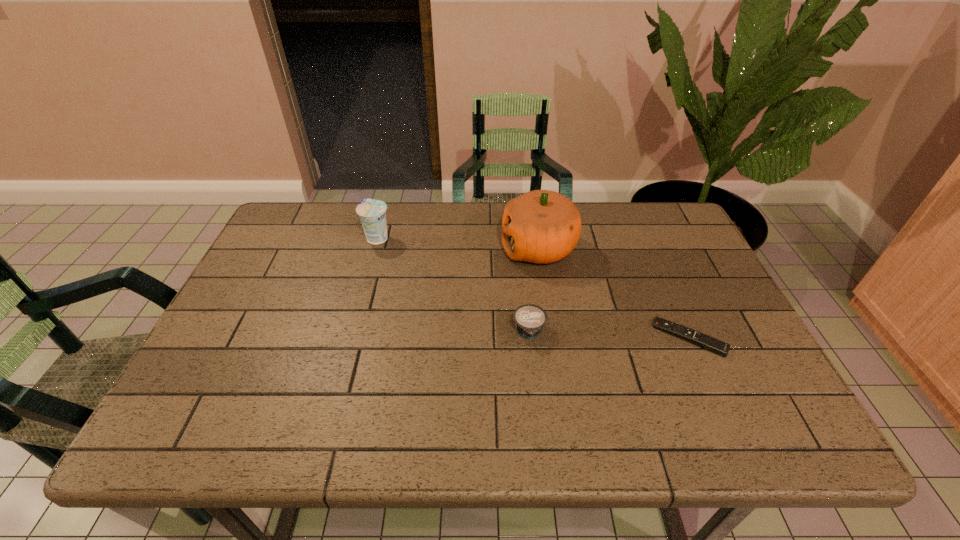
Find the location of a particular element. pumpkin is located at coordinates (541, 226).

Image resolution: width=960 pixels, height=540 pixels. Find the location of `the farther yogurt`. the farther yogurt is located at coordinates (372, 213).

Where is `the taller yogurt`? The height and width of the screenshot is (540, 960). the taller yogurt is located at coordinates (372, 213).

What are the coordinates of `the nearer yogurt` in the screenshot? It's located at (530, 319).

The width and height of the screenshot is (960, 540). In order to click on the right yogurt in this screenshot , I will do (x=530, y=319).

At what (x,y) coordinates should I click in order to perform the action: click on the rightmost object. Please return your answer as a coordinate pair (x, y). Looking at the image, I should click on (707, 342).

Find the location of `the shortest object`. the shortest object is located at coordinates (707, 342).

Identify the location of free space located on the face of the tallest object. (457, 248).

Where is `vacant point located 0.180m on the face of the tallest object`? vacant point located 0.180m on the face of the tallest object is located at coordinates (440, 248).

Identify the location of free region located 0.170m on the face of the tallest object. (444, 248).